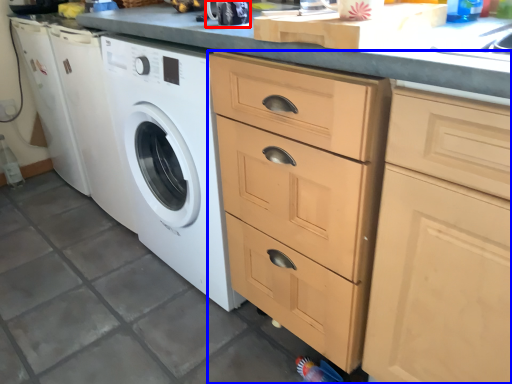
Question: Which object appears farthest to the camera in this image, appliance (highlighted by a red box) or cabinetry (highlighted by a blue box)?

Choices:
 (A) appliance
 (B) cabinetry

Answer: (A)